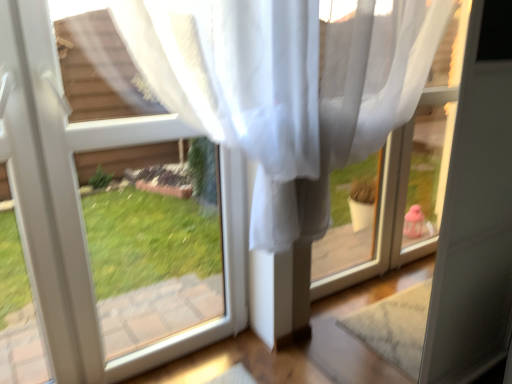
Question: Could you tell me if transparent plastic window frame at upper right is facing transparent fabric at upper left?

Choices:
 (A) yes
 (B) no

Answer: (A)

Question: Is transparent plastic window frame at upper right positioned in front of transparent fabric at upper left?

Choices:
 (A) yes
 (B) no

Answer: (A)

Question: Considering the relative sizes of transparent plastic window frame at upper right and transparent fabric at upper left in the image provided, is transparent plastic window frame at upper right wider than transparent fabric at upper left?

Choices:
 (A) yes
 (B) no

Answer: (B)

Question: Can you confirm if transparent plastic window frame at upper right is positioned to the left of transparent fabric at upper left?

Choices:
 (A) no
 (B) yes

Answer: (A)

Question: Considering the relative sizes of transparent plastic window frame at upper right and transparent fabric at upper left in the image provided, is transparent plastic window frame at upper right thinner than transparent fabric at upper left?

Choices:
 (A) yes
 (B) no

Answer: (A)

Question: Can you confirm if transparent plastic window frame at upper right is positioned to the right of transparent fabric at upper left?

Choices:
 (A) yes
 (B) no

Answer: (A)

Question: Does transparent fabric at upper left appear on the left side of transparent plastic window frame at upper right?

Choices:
 (A) no
 (B) yes

Answer: (B)

Question: From the image's perspective, does transparent fabric at upper left appear lower than transparent plastic window frame at upper right?

Choices:
 (A) no
 (B) yes

Answer: (A)

Question: Is transparent fabric at upper left not inside transparent plastic window frame at upper right?

Choices:
 (A) no
 (B) yes

Answer: (B)

Question: Considering the relative sizes of transparent fabric at upper left and transparent plastic window frame at upper right in the image provided, is transparent fabric at upper left shorter than transparent plastic window frame at upper right?

Choices:
 (A) yes
 (B) no

Answer: (A)

Question: Is transparent fabric at upper left aimed at transparent plastic window frame at upper right?

Choices:
 (A) no
 (B) yes

Answer: (A)

Question: Is transparent fabric at upper left further to the viewer compared to transparent plastic window frame at upper right?

Choices:
 (A) no
 (B) yes

Answer: (B)

Question: Considering the positions of transparent fabric at upper left and transparent plastic window frame at upper right in the image, is transparent fabric at upper left wider or thinner than transparent plastic window frame at upper right?

Choices:
 (A) thin
 (B) wide

Answer: (B)